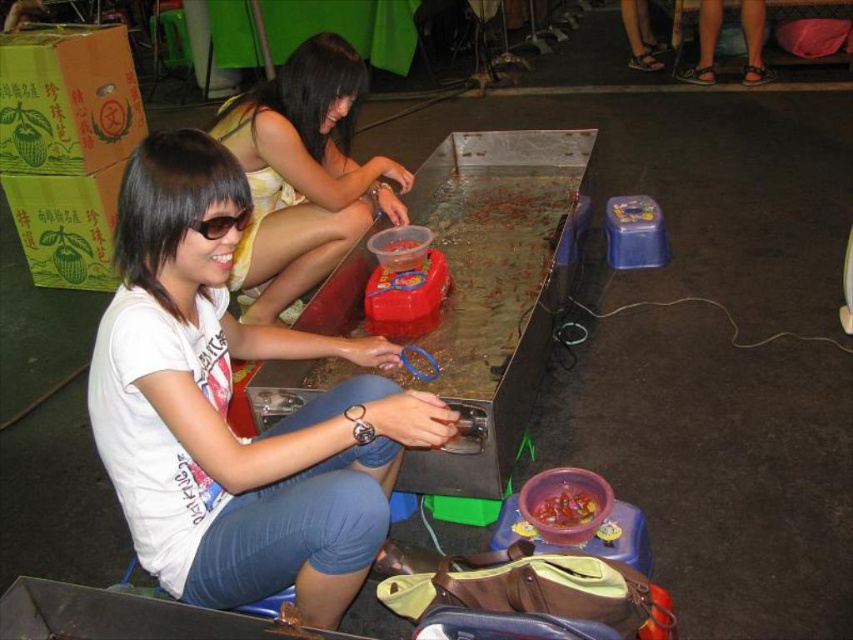
You are a customer at the food stall and want to use the black plastic goggles at left to protect your eyes while using the translucent plastic bowl at lower center. Based on their positions, can you reach the goggles before using the bowl?

The translucent plastic bowl at lower center is below the black plastic goggles at left, so you can reach the goggles first before using the bowl.

You are a customer at the food stall and want to use the black plastic goggles at left to protect your eyes while using the translucent plastic bucket at center. Based on their positions, can you reach the goggles before the bucket?

The translucent plastic bucket at center is located below the black plastic goggles at left, so you can reach the goggles first before the bucket.

You are standing at the point where the two people are sitting. You want to reach the red plastic container at point (318, 264) without moving your feet. Can you stretch your hand to reach it?

The distance of point (318, 264) from viewer is 2.49 meters. Since the average human arm length is about 0.7 meters, you cannot reach the red plastic container at point (318, 264) without moving your feet.